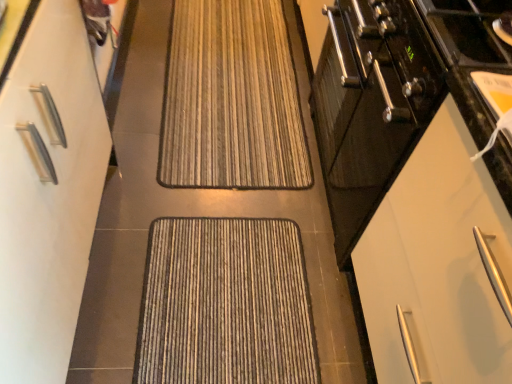
Identify the location of free location above brown striped mat at center, the second doormat from the bottom (from a real-world perspective). (222, 71).